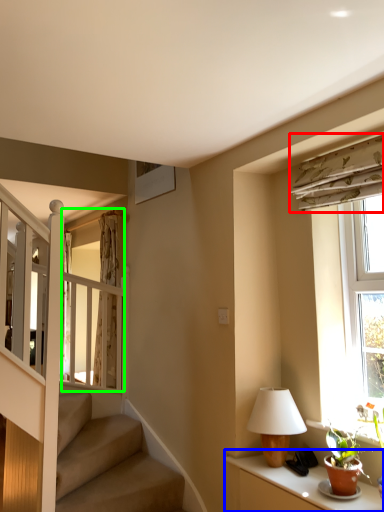
Question: Which object is the farthest from curtain (highlighted by a red box)? Choose among these: table (highlighted by a blue box) or glass door (highlighted by a green box).

Choices:
 (A) table
 (B) glass door

Answer: (B)